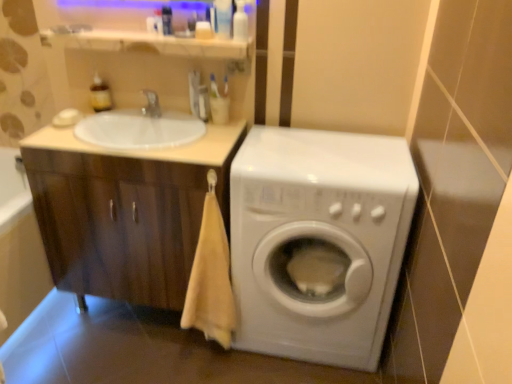
Locate an element on the screen. This screenshot has height=384, width=512. vacant space in between white glossy tap at upper center and translucent plastic toothbrush at upper center, which appears as the third toiletry when viewed from the left is located at coordinates (176, 122).